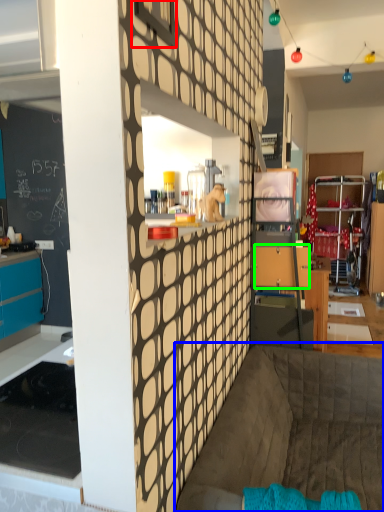
Question: Which object is positioned farthest from window (highlighted by a red box)? Select from couch (highlighted by a blue box) and drawer (highlighted by a green box).

Choices:
 (A) couch
 (B) drawer

Answer: (B)